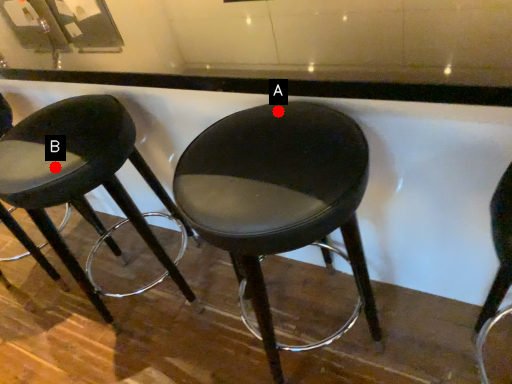
Question: Two points are circled on the image, labeled by A and B beside each circle. Which point is closer to the camera?

Choices:
 (A) A is closer
 (B) B is closer

Answer: (A)